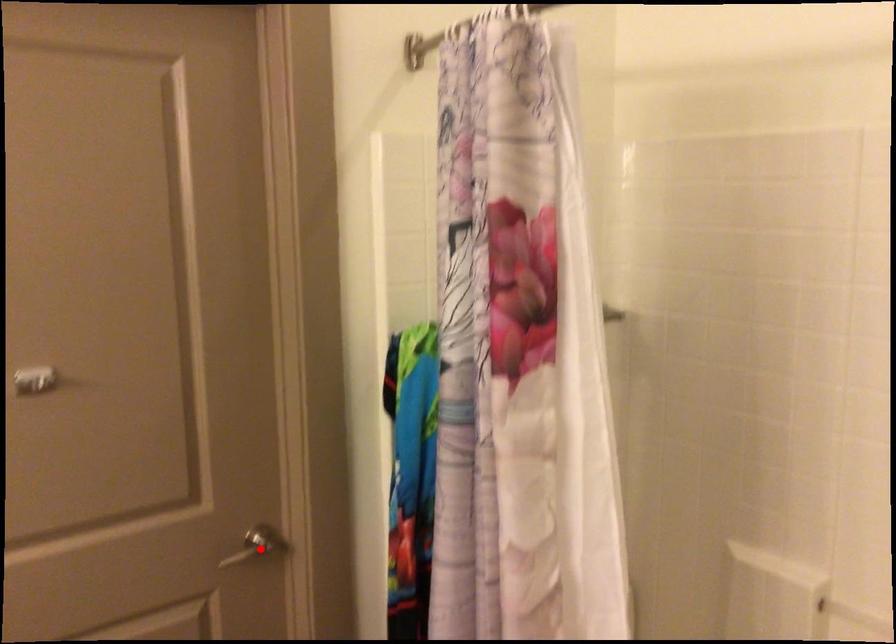
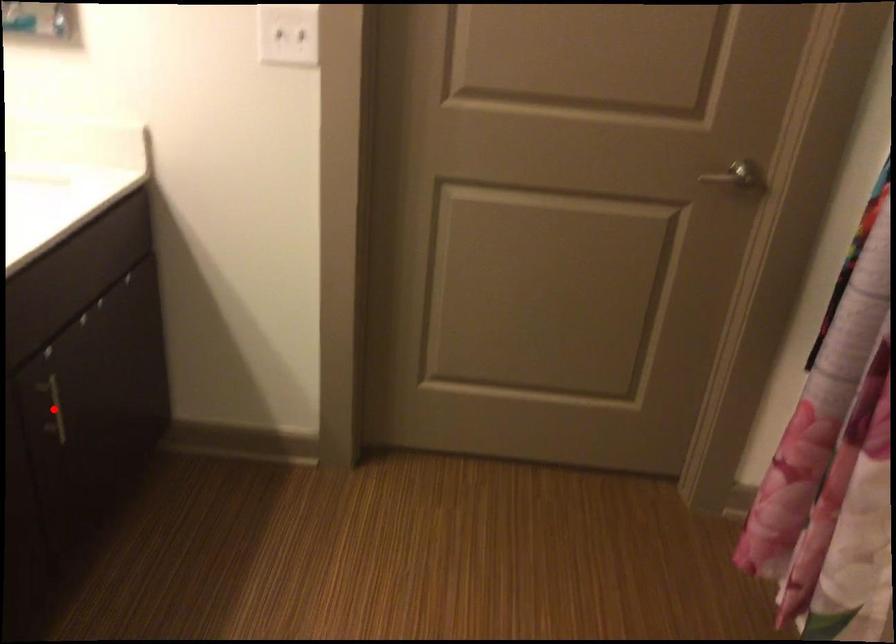
I am providing you with two images of the same scene from different viewpoints. A red point is marked on the first image and another point is marked on the second image. Do the highlighted points in image1 and image2 indicate the same real-world spot?

No